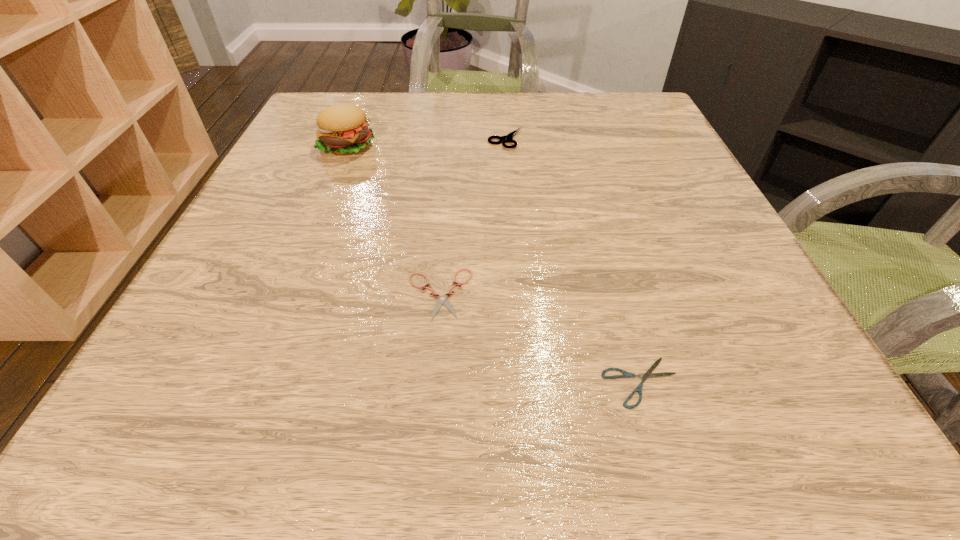
The width and height of the screenshot is (960, 540). Find the location of `the tallest object`. the tallest object is located at coordinates (342, 129).

What are the coordinates of `hamburger` in the screenshot? It's located at (342, 129).

Find the location of `the second shears from right to left`. the second shears from right to left is located at coordinates (507, 138).

Identify the location of the farthest shears. This screenshot has height=540, width=960. (507, 138).

Where is `the second nearest object`? This screenshot has height=540, width=960. the second nearest object is located at coordinates (441, 300).

Locate an element on the screen. The height and width of the screenshot is (540, 960). the second shortest object is located at coordinates (441, 300).

I want to click on the rightmost shears, so click(x=648, y=374).

This screenshot has height=540, width=960. I want to click on the rightmost object, so click(x=648, y=374).

Identify the location of vacant space located on the right of the tallest object. The image size is (960, 540). [x=403, y=145].

Locate an element on the screen. This screenshot has width=960, height=540. free space located on the back of the third object from left to right is located at coordinates (502, 99).